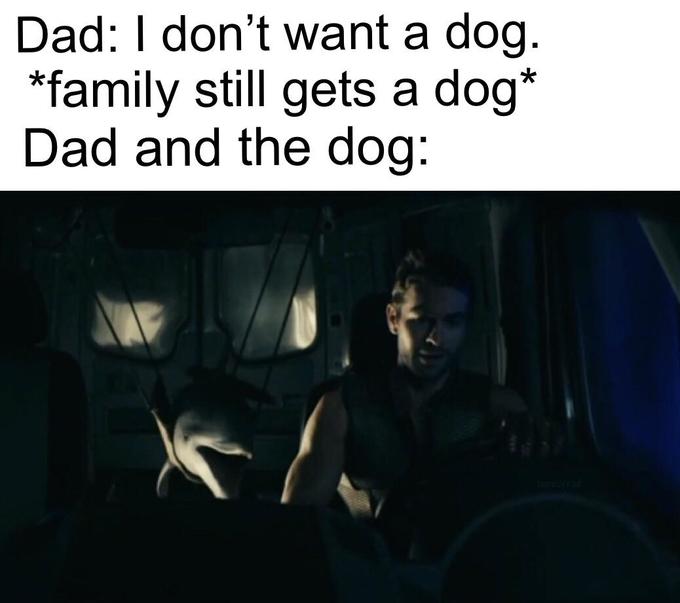
You are a GUI agent. You are given a task and a screenshot of the screen. Output one action in this format:
    pyautogui.click(x=<x>, y=<y>)
    Task: Click on the windows
    The image size is (680, 603).
    Given the screenshot: What is the action you would take?
    pyautogui.click(x=645, y=336), pyautogui.click(x=277, y=294), pyautogui.click(x=126, y=298)